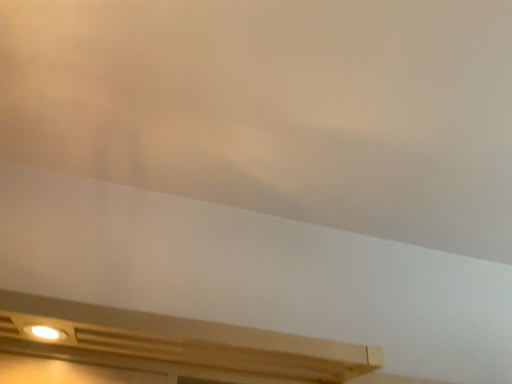
Question: Should I look upward or downward to see white matte cloud at upper center?

Choices:
 (A) up
 (B) down

Answer: (A)